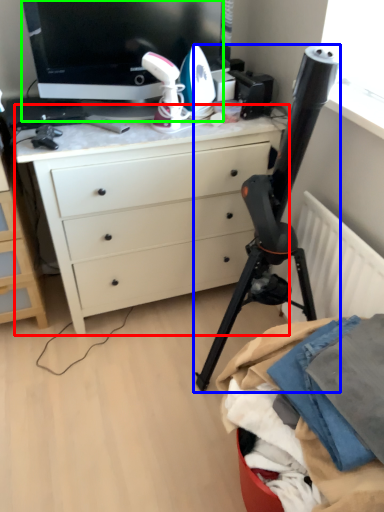
Question: Based on their relative distances, which object is nearer to desk (highlighted by a red box)? Choose from tripod (highlighted by a blue box) and television (highlighted by a green box).

Choices:
 (A) tripod
 (B) television

Answer: (A)